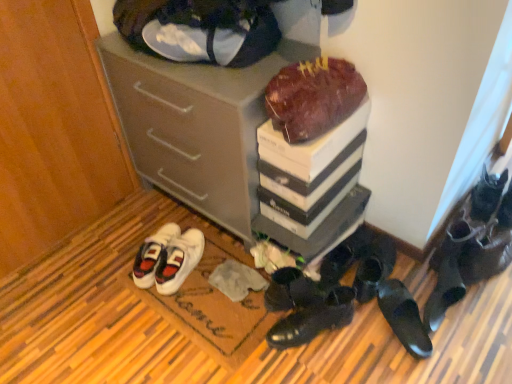
The width and height of the screenshot is (512, 384). Identify the location of free space in front of white suede sneakers at lower left, marked as the first footwear in a left-to-right arrangement. click(x=194, y=310).